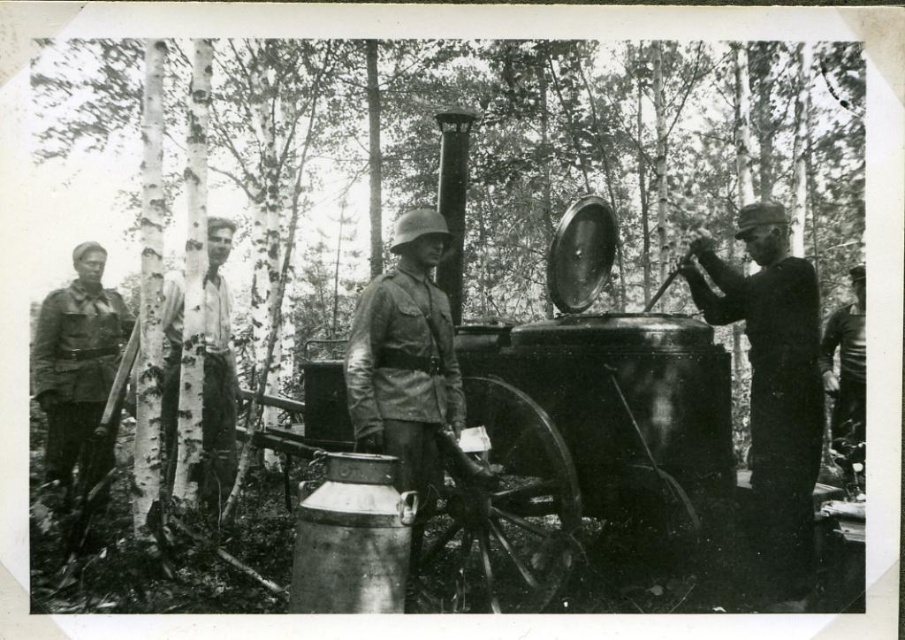
Is camouflage fabric uniform at center wider than white cotton shirt at center?

In fact, camouflage fabric uniform at center might be narrower than white cotton shirt at center.

Can you confirm if camouflage fabric uniform at center is bigger than white cotton shirt at center?

No.

Which is behind, point (401, 419) or point (205, 429)?

Point (205, 429)

Locate an element on the screen. The width and height of the screenshot is (905, 640). camouflage fabric uniform at center is located at coordinates point(403,376).

Is the position of white cotton shirt at center less distant than that of smooth leather jacket at right?

Yes, it is in front of smooth leather jacket at right.

Can you confirm if white cotton shirt at center is positioned below smooth leather jacket at right?

Incorrect, white cotton shirt at center is not positioned below smooth leather jacket at right.

Does point (208, 387) lie in front of point (846, 426)?

Yes.

Locate an element on the screen. white cotton shirt at center is located at coordinates (217, 372).

Can you confirm if uniformed man at right is thinner than camouflage fabric uniform at left?

Correct, uniformed man at right's width is less than camouflage fabric uniform at left's.

Between uniformed man at right and camouflage fabric uniform at left, which one is positioned higher?

Positioned higher is camouflage fabric uniform at left.

Locate an element on the screen. The height and width of the screenshot is (640, 905). uniformed man at right is located at coordinates (773, 387).